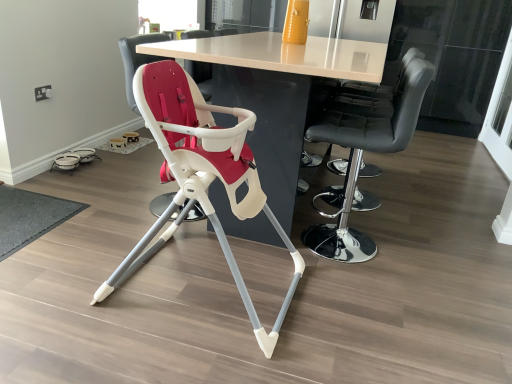
The image size is (512, 384). In order to click on free space in front of white plastic highchair at center, the 1th chair when ordered from left to right in this screenshot , I will do `click(138, 235)`.